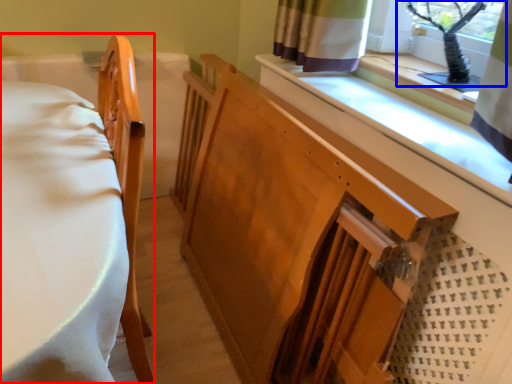
Question: Among these objects, which one is farthest to the camera, furniture (highlighted by a red box) or window screen (highlighted by a blue box)?

Choices:
 (A) furniture
 (B) window screen

Answer: (B)